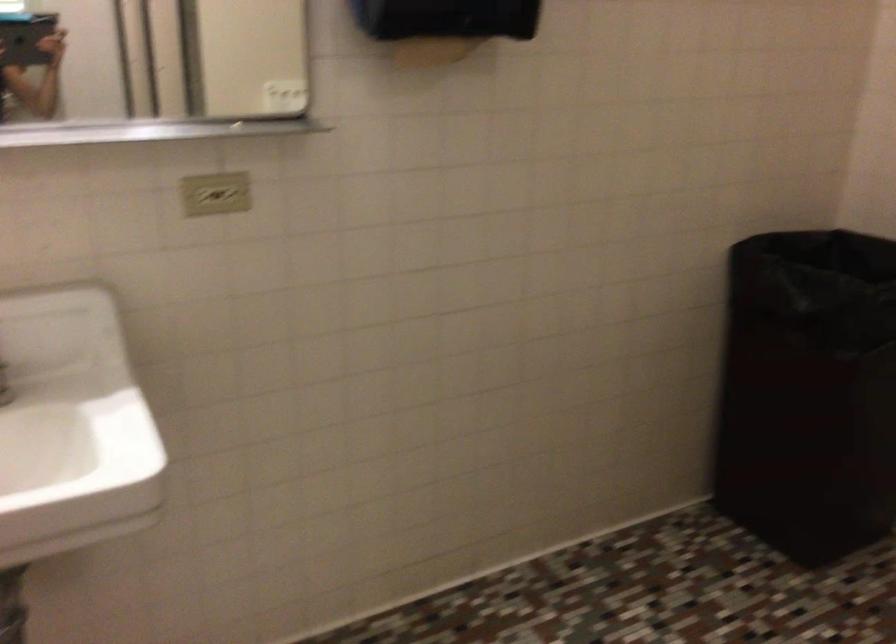
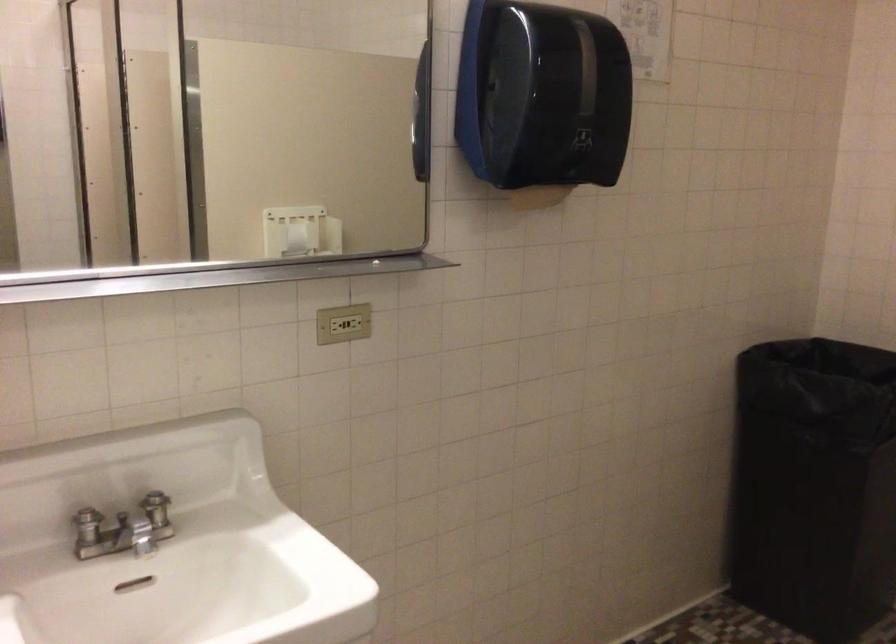
Locate, in the second image, the point that corresponds to point (216, 196) in the first image.

(342, 323)